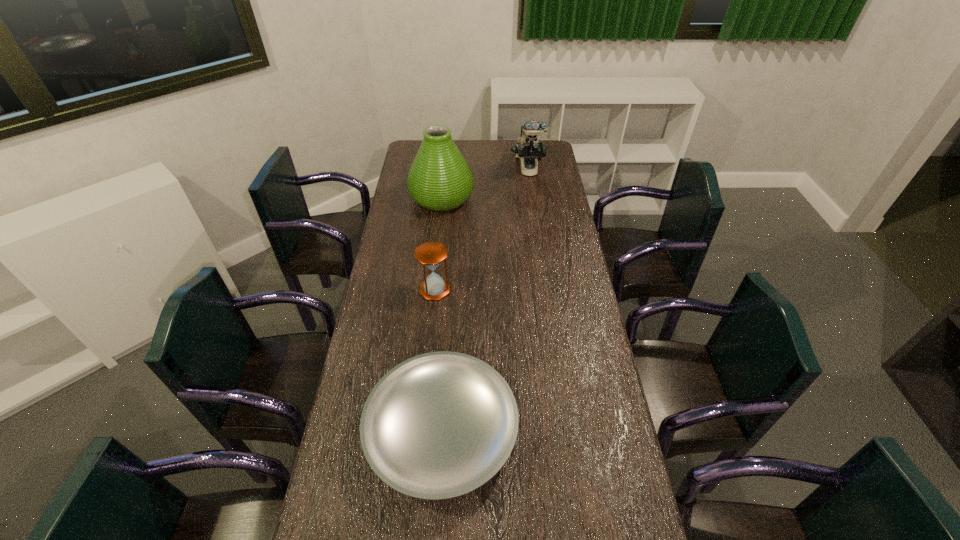
Locate an element on the screen. The width and height of the screenshot is (960, 540). free space between the microscope and the shortest object is located at coordinates (485, 300).

Find the location of `free spot between the nearest object and the rightmost object`. free spot between the nearest object and the rightmost object is located at coordinates (485, 300).

In order to click on free space between the shortest object and the vase in this screenshot , I will do `click(442, 315)`.

The image size is (960, 540). What are the coordinates of `object that is the third nearest to the nearest object` in the screenshot? It's located at (528, 149).

Identify the location of object that stands as the closest to the third tallest object. (439, 425).